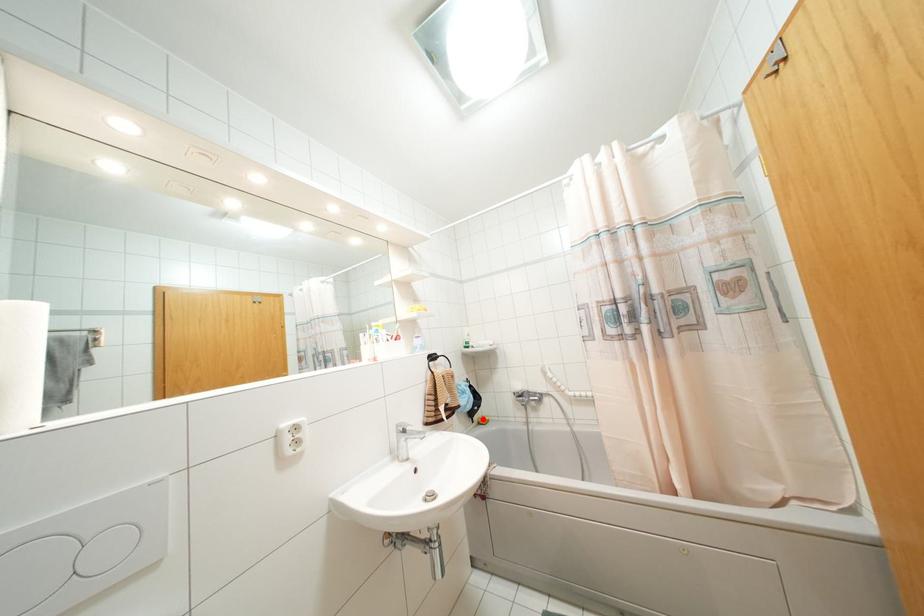
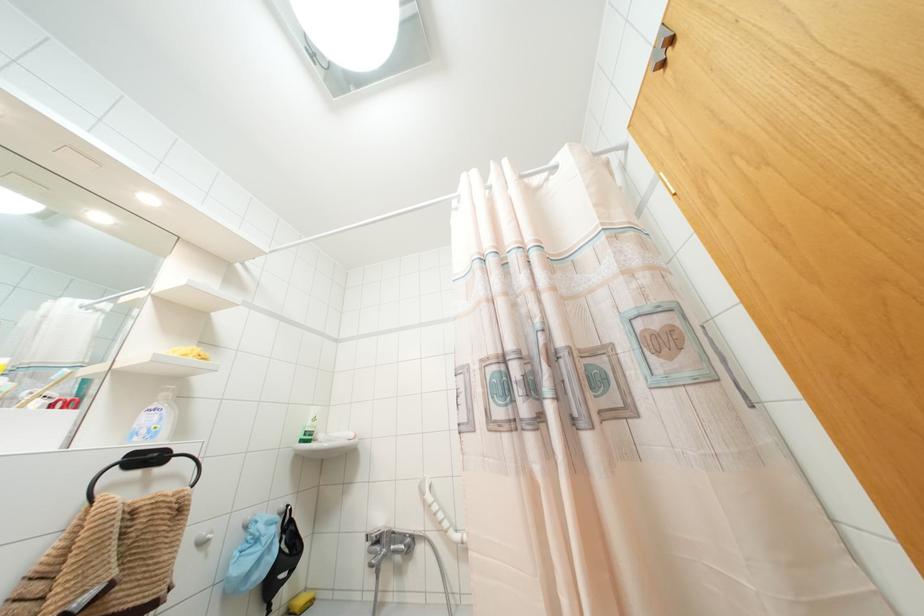
Find the pixel in the second image that matches the highlighted location in the first image.

(299, 601)